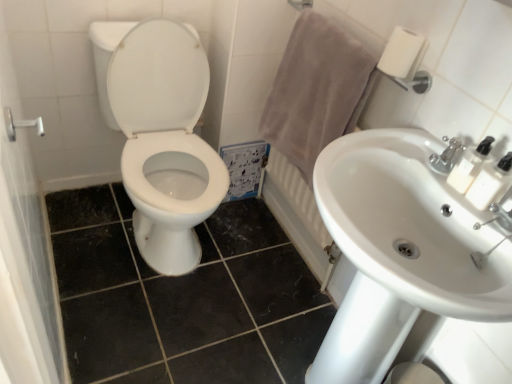
Question: Can you confirm if brushed metal shower handle at left is positioned to the left of white ceramic faucet at upper right?

Choices:
 (A) no
 (B) yes

Answer: (B)

Question: Considering the relative sizes of brushed metal shower handle at left and white ceramic faucet at upper right in the image provided, is brushed metal shower handle at left thinner than white ceramic faucet at upper right?

Choices:
 (A) no
 (B) yes

Answer: (B)

Question: Considering the relative sizes of brushed metal shower handle at left and white ceramic faucet at upper right in the image provided, is brushed metal shower handle at left taller than white ceramic faucet at upper right?

Choices:
 (A) no
 (B) yes

Answer: (A)

Question: Is brushed metal shower handle at left behind white ceramic faucet at upper right?

Choices:
 (A) yes
 (B) no

Answer: (B)

Question: From the image's perspective, is brushed metal shower handle at left on white ceramic faucet at upper right?

Choices:
 (A) yes
 (B) no

Answer: (A)

Question: Visually, is beige cotton towel at upper right positioned to the left or to the right of white ceramic radiator at upper right?

Choices:
 (A) right
 (B) left

Answer: (B)

Question: In the image, is beige cotton towel at upper right positioned in front of or behind white ceramic radiator at upper right?

Choices:
 (A) behind
 (B) front

Answer: (B)

Question: Does point (293, 162) appear closer or farther from the camera than point (330, 261)?

Choices:
 (A) farther
 (B) closer

Answer: (B)

Question: In terms of size, does beige cotton towel at upper right appear bigger or smaller than white ceramic radiator at upper right?

Choices:
 (A) small
 (B) big

Answer: (B)

Question: Is white ceramic faucet at upper right wider or thinner than white glossy sink at center right?

Choices:
 (A) wide
 (B) thin

Answer: (B)

Question: Would you say white ceramic faucet at upper right is inside or outside white glossy sink at center right?

Choices:
 (A) inside
 (B) outside

Answer: (B)

Question: Based on their positions, is white ceramic faucet at upper right located to the left or right of white glossy sink at center right?

Choices:
 (A) right
 (B) left

Answer: (A)

Question: Is point (481, 225) positioned closer to the camera than point (426, 158)?

Choices:
 (A) farther
 (B) closer

Answer: (B)

Question: Is white plastic soap dispenser at upper right, which ranks as the 1th soap dispenser in top-to-bottom order, inside or outside of white ceramic radiator at upper right?

Choices:
 (A) inside
 (B) outside

Answer: (B)

Question: From a real-world perspective, is white plastic soap dispenser at upper right, which ranks as the 1th soap dispenser in top-to-bottom order, above or below white ceramic radiator at upper right?

Choices:
 (A) below
 (B) above

Answer: (B)